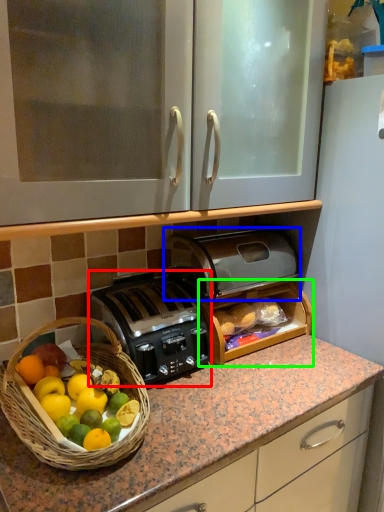
Question: Considering the real-world distances, which object is farthest from toaster (highlighted by a red box)? toaster (highlighted by a blue box) or cabinetry (highlighted by a green box)?

Choices:
 (A) toaster
 (B) cabinetry

Answer: (A)